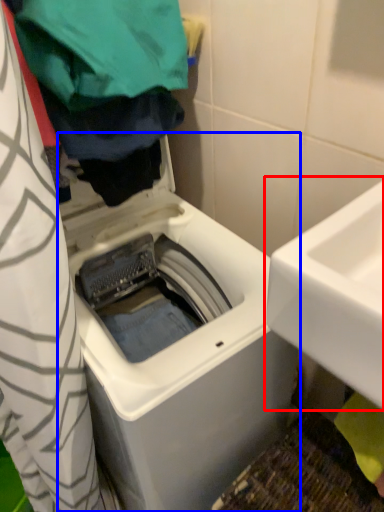
Question: Which point is further to the camera, sink (highlighted by a red box) or washing machine (highlighted by a blue box)?

Choices:
 (A) sink
 (B) washing machine

Answer: (B)